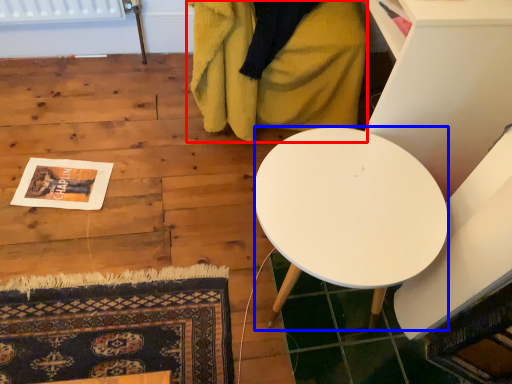
Question: Which object appears closest to the camera in this image, blanket (highlighted by a red box) or desk (highlighted by a blue box)?

Choices:
 (A) blanket
 (B) desk

Answer: (B)